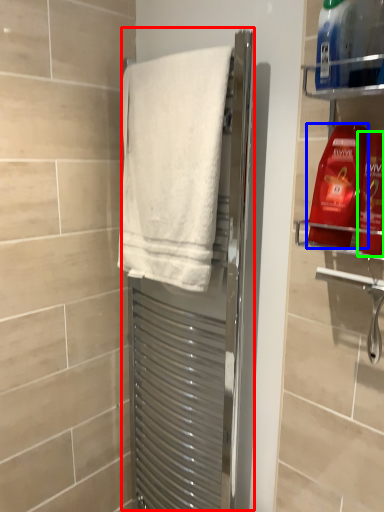
Question: Which object is the closest to the screen door (highlighted by a red box)? Choose among these: cleaning product (highlighted by a blue box) or cleaning product (highlighted by a green box).

Choices:
 (A) cleaning product
 (B) cleaning product

Answer: (A)